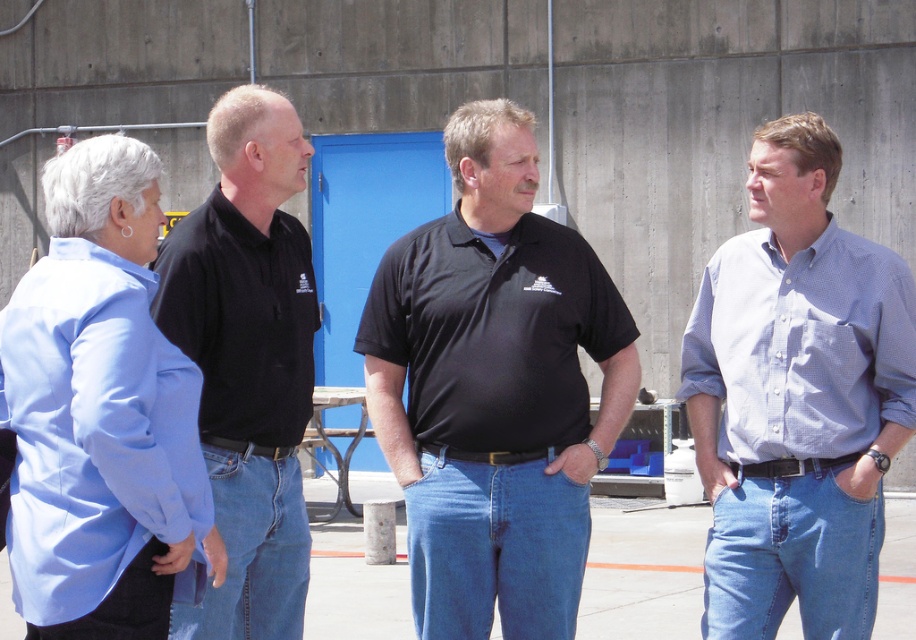
You are a photographer standing at the center of the scene. You want to take a photo that includes the light blue textured shirt at right. Based on its position, where should you aim your camera to ensure it is in the frame?

The light blue textured shirt at right is located at coordinates approximately 0.541 on the x axis and 0.877 on the y axis, so aim your camera towards that point to include it in the frame.

You are a photographer trying to capture a group photo of the blue checkered shirt at right and the light blue textured shirt at right. Since you want both shirts to appear the same size in the photo, where should you position yourself relative to them?

To make the blue checkered shirt at right and the light blue textured shirt at right appear the same size in the photo, you should move closer to the smaller light blue textured shirt at right because the blue checkered shirt at right is larger in size. This adjustment balances their apparent sizes in the frame.

You are an observer looking at the scene. There is a black cotton polo shirt at center and denim jeans at right. Which clothing item is located higher on the person?

The black cotton polo shirt at center is positioned over denim jeans at right, so the black cotton polo shirt at center is higher.